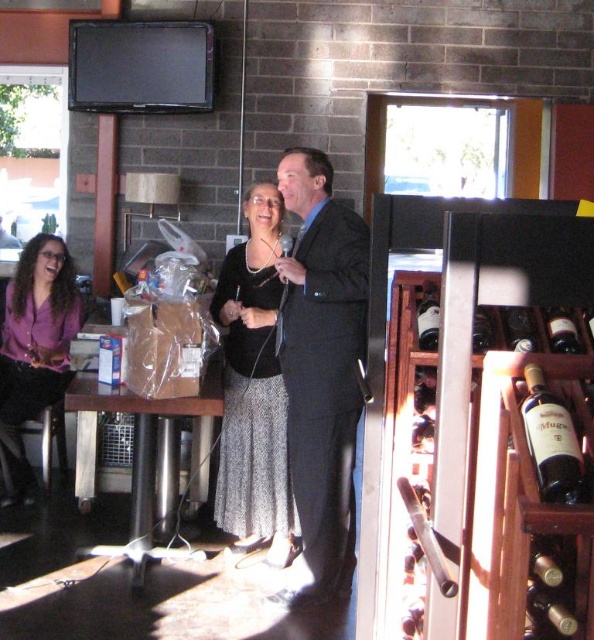
You are a photographer setting up for an event in this dining area. You need to position a spotlight so it can illuminate both the silver metallic skirt at center and the purple matte blouse at left without overlapping the light beams. Given their sizes, which object requires a wider spotlight beam?

The silver metallic skirt at center requires a wider spotlight beam because it is larger in size than the purple matte blouse at left.

You are a photographer positioned at the back of the room. You need to capture a photo of both the silver metallic skirt at center and the purple matte blouse at left in the same frame. Considering their distance apart, will you need to adjust your camera to a wider angle to include both subjects?

The silver metallic skirt at center is 4.13 feet away from the purple matte blouse at left. To capture both in the same frame, you would need to adjust your camera to a wider angle to accommodate the distance between them.

You are a photographer setting up for an event. You notice the silver metallic skirt at center and the dark brown glass bottle at center right in the scene. Which object is closer to the left side of the frame?

The silver metallic skirt at center is positioned on the left side of the dark brown glass bottle at center right, so it is closer to the left side of the frame.